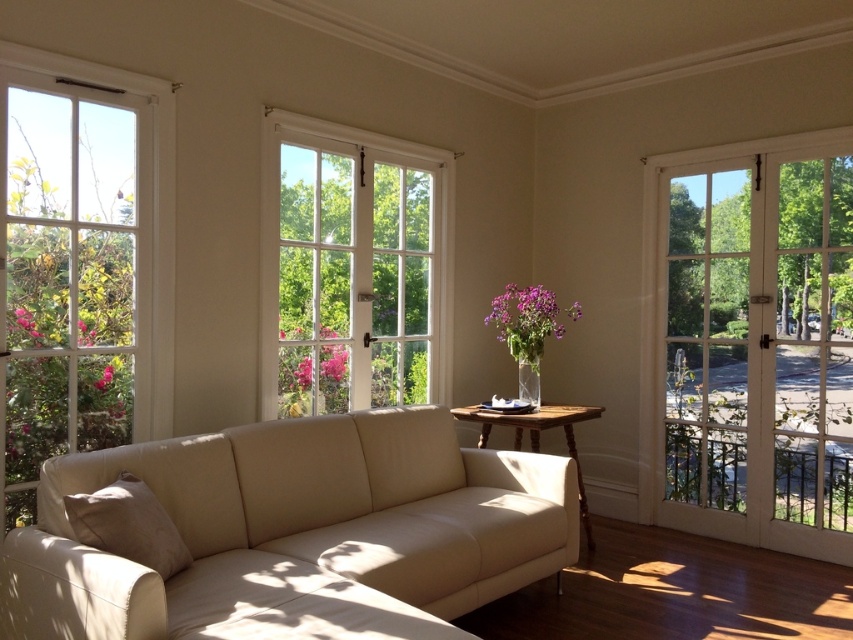
Which of these two, beige leather couch at center or clear glass window at left, stands shorter?

beige leather couch at center

Is point (341, 561) closer to viewer compared to point (7, 285)?

Yes, point (341, 561) is closer to viewer.

Where is `beige leather couch at center`? The height and width of the screenshot is (640, 853). beige leather couch at center is located at coordinates (299, 532).

Is the position of clear glass window at left more distant than that of white wooden window at center?

No, it is in front of white wooden window at center.

Which is behind, point (21, 440) or point (314, 371)?

The point (314, 371) is more distant.

This screenshot has width=853, height=640. I want to click on clear glass window at left, so click(82, 260).

Consider the image. Is beige leather couch at center further to the viewer compared to white wooden window at center?

No, beige leather couch at center is in front of white wooden window at center.

Is point (465, 449) farther from camera compared to point (334, 224)?

No.

Find the location of a particular element. beige leather couch at center is located at coordinates (299, 532).